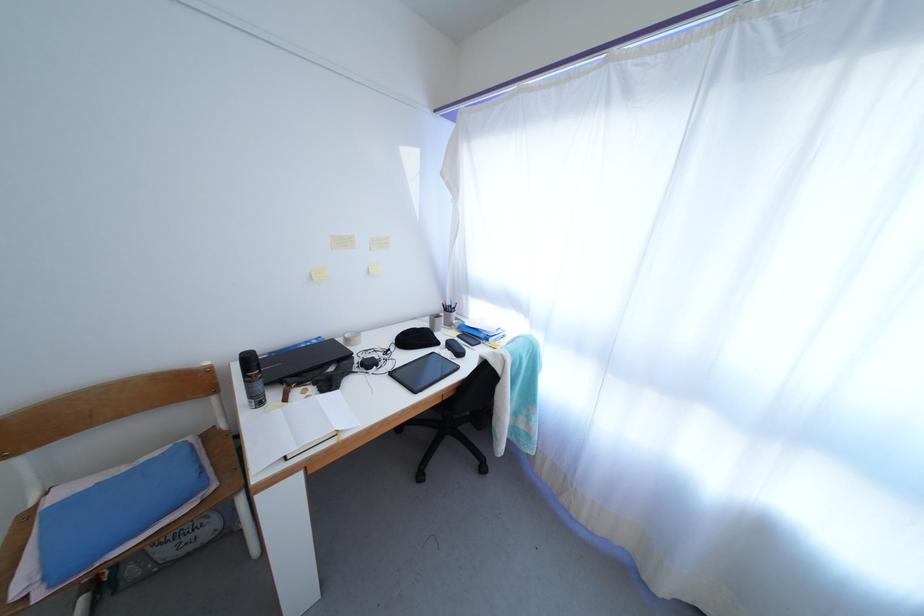
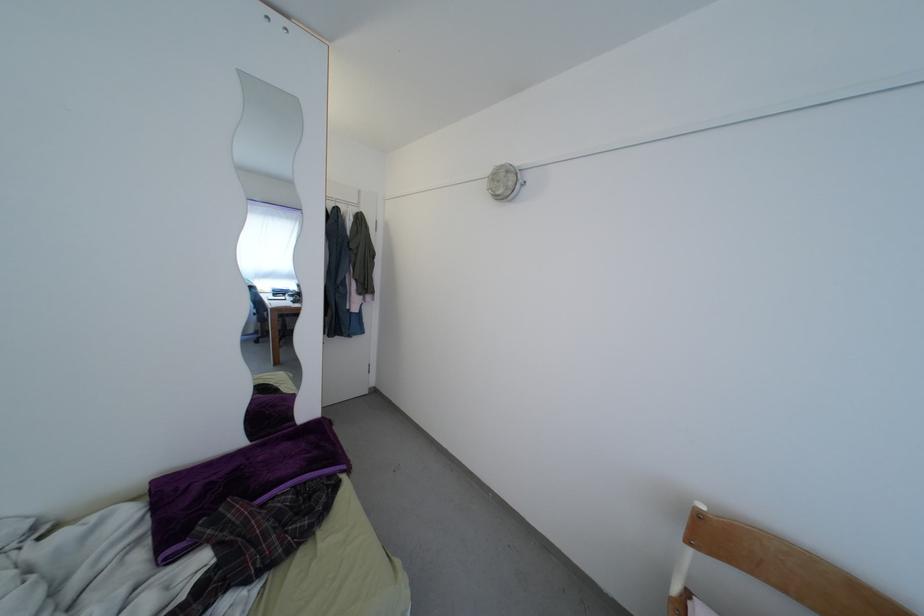
Question: The images are taken continuously from a first-person perspective. In which direction is your viewpoint rotating?

Choices:
 (A) Left
 (B) Right
 (C) Up
 (D) Down

Answer: (A)